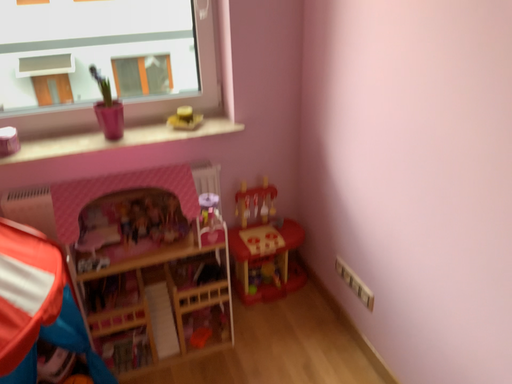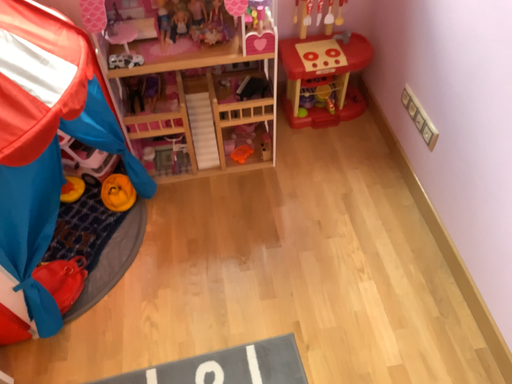
Question: How did the camera likely rotate when shooting the video?

Choices:
 (A) rotated right
 (B) rotated left

Answer: (B)